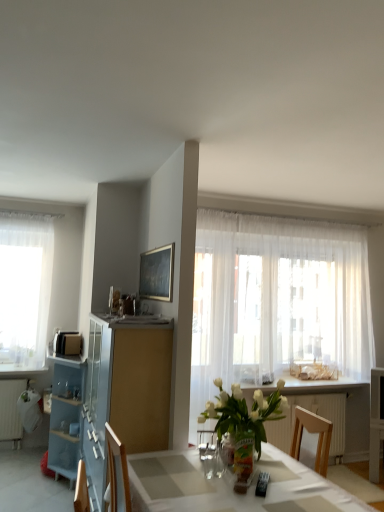
At what (x,y) coordinates should I click in order to perform the action: click on vacant space to the left of clear glass vase at center. Please return your answer as a coordinate pair (x, y). This screenshot has width=384, height=512. Looking at the image, I should click on click(215, 469).